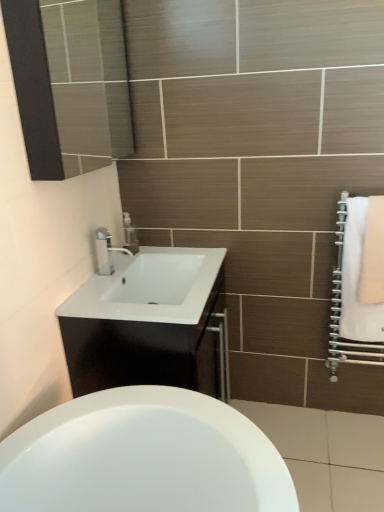
Question: In terms of height, does white glossy cabinet at center look taller or shorter compared to clear plastic soap dispenser at upper center?

Choices:
 (A) tall
 (B) short

Answer: (A)

Question: From a real-world perspective, is white glossy cabinet at center above or below clear plastic soap dispenser at upper center?

Choices:
 (A) above
 (B) below

Answer: (B)

Question: Which of these objects is positioned farthest from the satin nickel faucet at center?

Choices:
 (A) white soft towel at right, arranged as the first bath towel when viewed from the left
 (B) black glass mirror at upper left
 (C) white glossy cabinet at center
 (D) clear plastic soap dispenser at upper center
 (E) white soft towel at right, the second bath towel viewed from the left

Answer: (E)

Question: Which object is the closest to the white soft towel at right, arranged as the first bath towel when viewed from the left?

Choices:
 (A) satin nickel faucet at center
 (B) black glass mirror at upper left
 (C) clear plastic soap dispenser at upper center
 (D) white soft towel at right, the second bath towel viewed from the left
 (E) white glossy cabinet at center

Answer: (D)